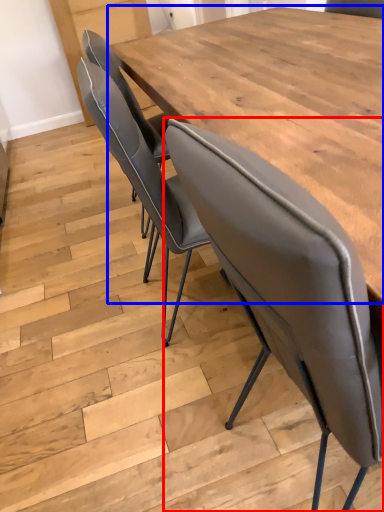
Question: Among these objects, which one is nearest to the camera, chair (highlighted by a red box) or table (highlighted by a blue box)?

Choices:
 (A) chair
 (B) table

Answer: (A)